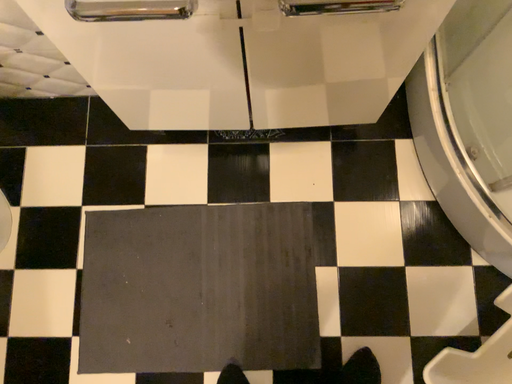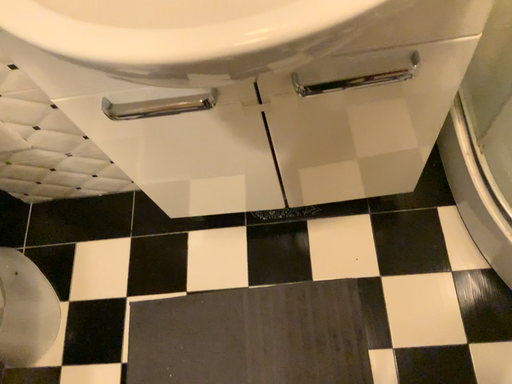
Question: How did the camera likely rotate when shooting the video?

Choices:
 (A) rotated downward
 (B) rotated upward

Answer: (B)